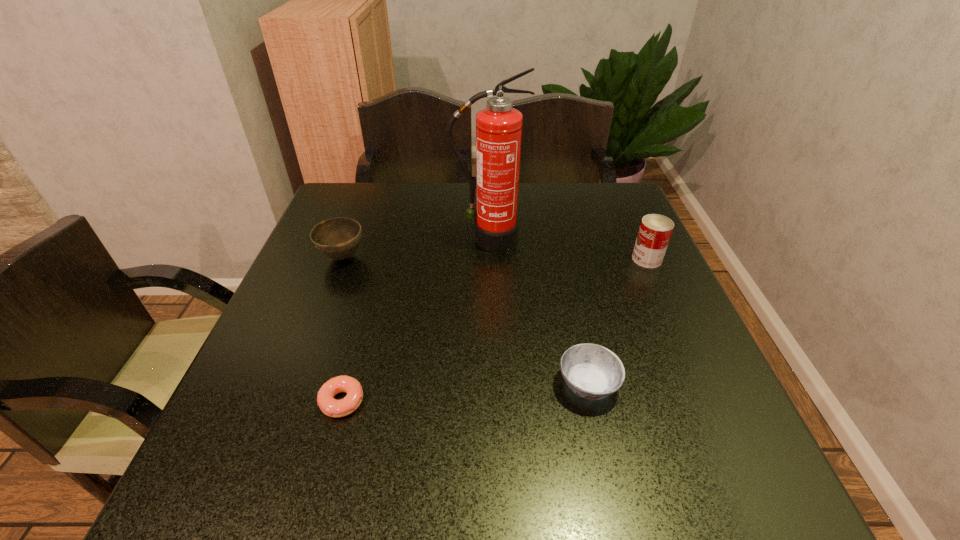
Locate an element on the screen. The height and width of the screenshot is (540, 960). free spot located on the front label of the rightmost object is located at coordinates (612, 259).

At what (x,y) coordinates should I click in order to perform the action: click on vacant space located on the front label of the rightmost object. Please return your answer as a coordinate pair (x, y). The width and height of the screenshot is (960, 540). Looking at the image, I should click on (582, 259).

The height and width of the screenshot is (540, 960). Identify the location of vacant area situated 0.260m on the back of the third shortest object. (367, 193).

Image resolution: width=960 pixels, height=540 pixels. Identify the location of vacant space positioned on the front of the second shortest object. (601, 443).

Image resolution: width=960 pixels, height=540 pixels. I want to click on free space located 0.320m on the back of the doughnut, so click(376, 274).

Locate an element on the screen. Image resolution: width=960 pixels, height=540 pixels. object present at the left edge is located at coordinates (338, 238).

Find the location of `object present at the right edge`. object present at the right edge is located at coordinates (655, 231).

In the image, there is a desktop. Identify the location of free space at the far edge. This screenshot has width=960, height=540. (409, 210).

Image resolution: width=960 pixels, height=540 pixels. What are the coordinates of `free space at the left edge` in the screenshot? It's located at (348, 301).

Find the location of `free region at the right edge of the desktop`. free region at the right edge of the desktop is located at coordinates (600, 246).